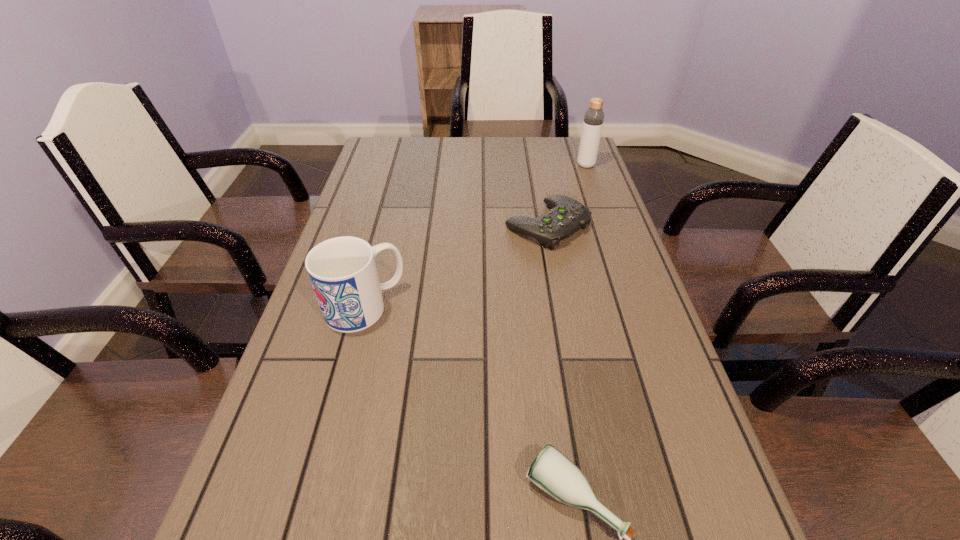
The width and height of the screenshot is (960, 540). Identify the location of the farther bottle. tap(593, 121).

Identify the location of the right bottle. (593, 121).

At what (x,y) coordinates should I click in order to perform the action: click on the second tallest object. Please return your answer as a coordinate pair (x, y). This screenshot has width=960, height=540. Looking at the image, I should click on (342, 270).

The height and width of the screenshot is (540, 960). In order to click on the leftmost object in this screenshot , I will do `click(342, 270)`.

At what (x,y) coordinates should I click in order to perform the action: click on control. Please return your answer as a coordinate pair (x, y). Looking at the image, I should click on (566, 217).

Locate an element on the screen. This screenshot has height=540, width=960. the shortest object is located at coordinates (566, 217).

Locate an element on the screen. vacant space situated on the left of the farthest object is located at coordinates (469, 165).

Find the location of a particular element. This screenshot has height=540, width=960. vacant region located on the right of the leftmost object is located at coordinates (452, 306).

Identify the location of vacant space positioned on the left of the control. (410, 225).

The image size is (960, 540). I want to click on object that is at the far edge, so click(593, 121).